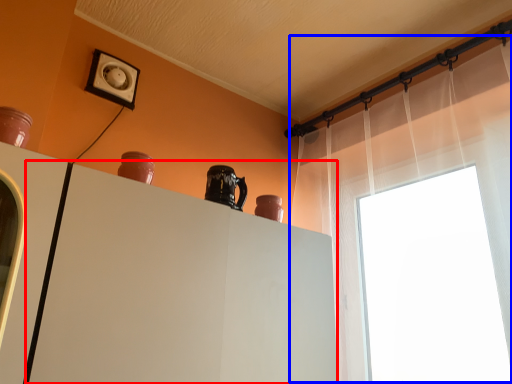
Question: Which of the following is the farthest to the observer, cabinetry (highlighted by a red box) or shower curtain (highlighted by a blue box)?

Choices:
 (A) cabinetry
 (B) shower curtain

Answer: (B)